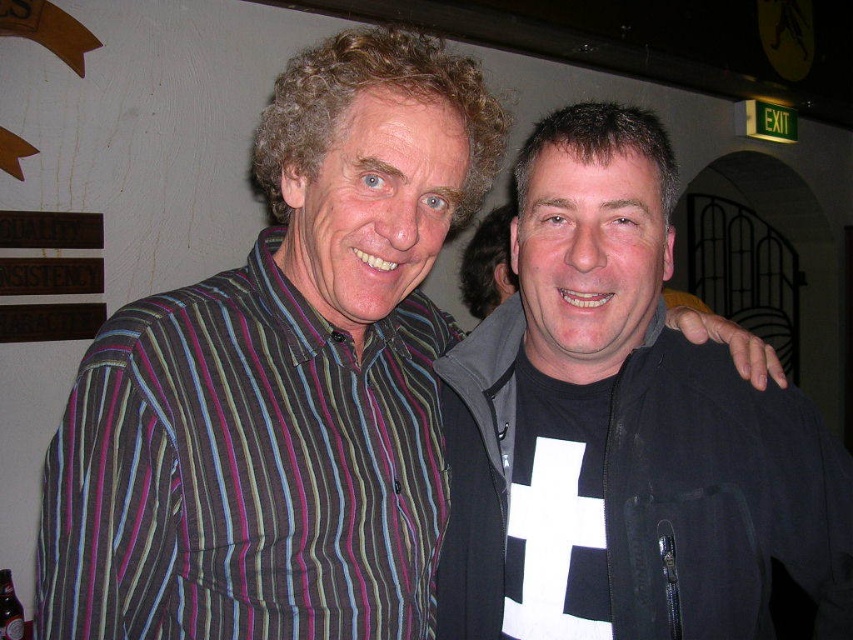
You are standing at point (111, 353) and want to walk to point (647, 440). Is the destination point behind you or in front of you?

The destination point (647, 440) is behind point (111, 353), so the destination is behind you.

You are a photographer setting up for a group photo. You notice the black matte jacket at right and the striped cotton shirt at left in the frame. Which clothing item is positioned higher in the image?

The black matte jacket at right is positioned higher in the image than the striped cotton shirt at left.

You are at a bar and want to grab the brown glass bottle at lower left without touching the black matte jacket at right. Is it possible based on their positions?

The black matte jacket at right is to the right of the brown glass bottle at lower left, so there is space between them. You can reach the brown glass bottle at lower left without touching the black matte jacket at right.